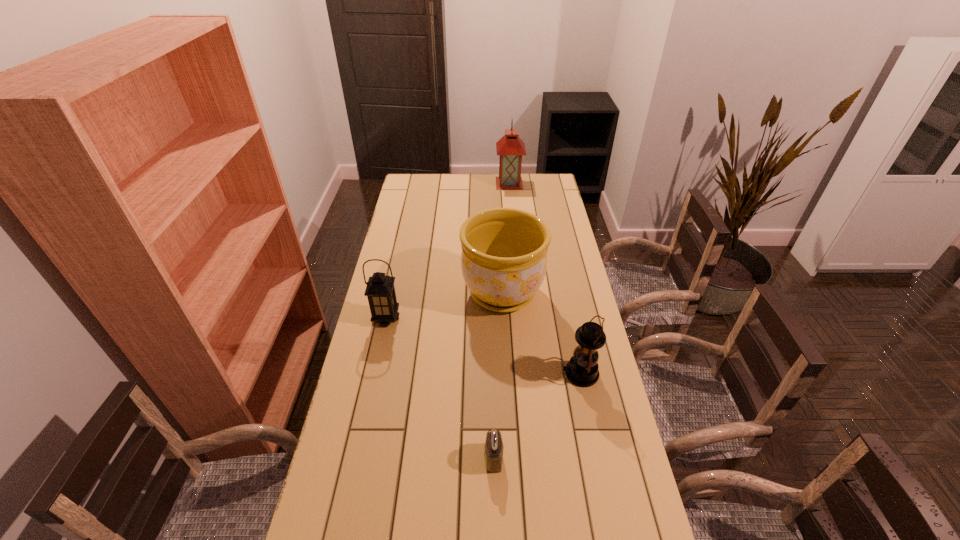
Identify the location of flowerpot present at the right edge. pyautogui.click(x=504, y=250).

Find the location of a particular element. lantern that is at the right edge is located at coordinates (582, 370).

In the image, there is a desktop. Where is `free region at the far edge`? The width and height of the screenshot is (960, 540). free region at the far edge is located at coordinates (460, 195).

The width and height of the screenshot is (960, 540). In order to click on vacant area at the left edge in this screenshot , I will do `click(334, 470)`.

This screenshot has height=540, width=960. I want to click on free space at the right edge, so click(x=550, y=317).

What are the coordinates of `vacant area at the far left corner` in the screenshot? It's located at (410, 196).

This screenshot has width=960, height=540. I want to click on vacant region between the nearest object and the rightmost object, so click(x=537, y=416).

The height and width of the screenshot is (540, 960). I want to click on vacant region between the second farthest lantern and the farthest object, so click(447, 251).

The image size is (960, 540). Identify the location of free area in between the rightmost object and the shortest object. (537, 416).

The height and width of the screenshot is (540, 960). Identify the location of unoccupied position between the fourth farthest object and the nearest object. (537, 416).